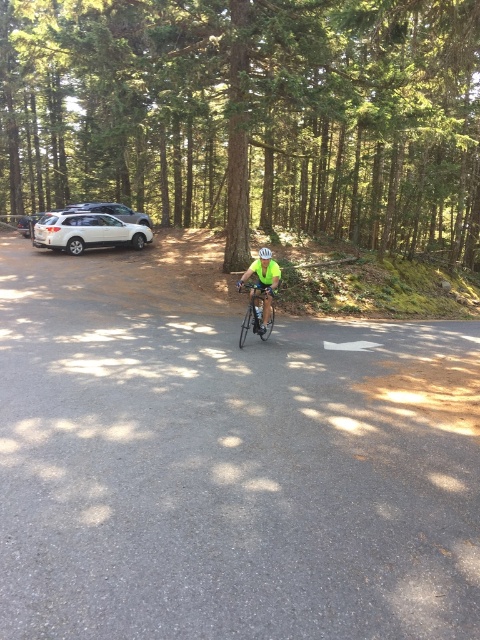
Is green matte bicycle at center smaller than white matte bicycle helmet at center?

Indeed, green matte bicycle at center has a smaller size compared to white matte bicycle helmet at center.

Does green matte bicycle at center appear on the right side of white matte bicycle helmet at center?

In fact, green matte bicycle at center is to the left of white matte bicycle helmet at center.

This screenshot has width=480, height=640. Describe the element at coordinates (256, 310) in the screenshot. I see `green matte bicycle at center` at that location.

Locate an element on the screen. green matte bicycle at center is located at coordinates (256, 310).

Who is more forward, [384,116] or [101,212]?

Positioned in front is point [384,116].

Who is shorter, green textured tree at center or white matte suv at left?

white matte suv at left

Between point (71, 157) and point (107, 228), which one is positioned in front?

Point (107, 228) is more forward.

Locate an element on the screen. The image size is (480, 640). green textured tree at center is located at coordinates (251, 115).

Between white matte suv at left and green matte bicycle at center, which one appears on the right side from the viewer's perspective?

From the viewer's perspective, green matte bicycle at center appears more on the right side.

Does white matte suv at left appear under green matte bicycle at center?

No, white matte suv at left is not below green matte bicycle at center.

Which is behind, point (133, 243) or point (247, 284)?

The point (133, 243) is more distant.

Locate an element on the screen. Image resolution: width=480 pixels, height=640 pixels. white matte suv at left is located at coordinates (87, 230).